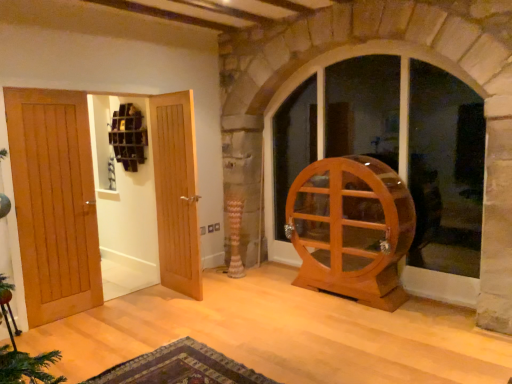
Identify the location of free spot to the right of light brown wood door at left, the 3th door in the right-to-left sequence. (102, 316).